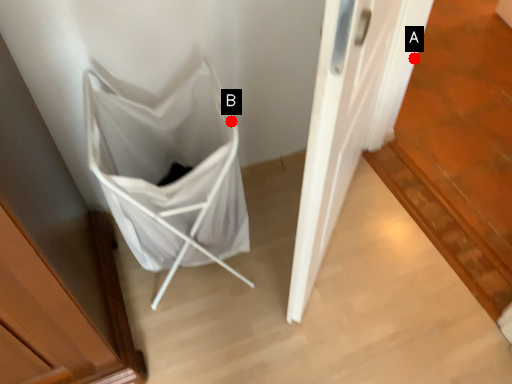
Question: Two points are circled on the image, labeled by A and B beside each circle. Among these points, which one is nearest to the camera?

Choices:
 (A) A is closer
 (B) B is closer

Answer: (B)